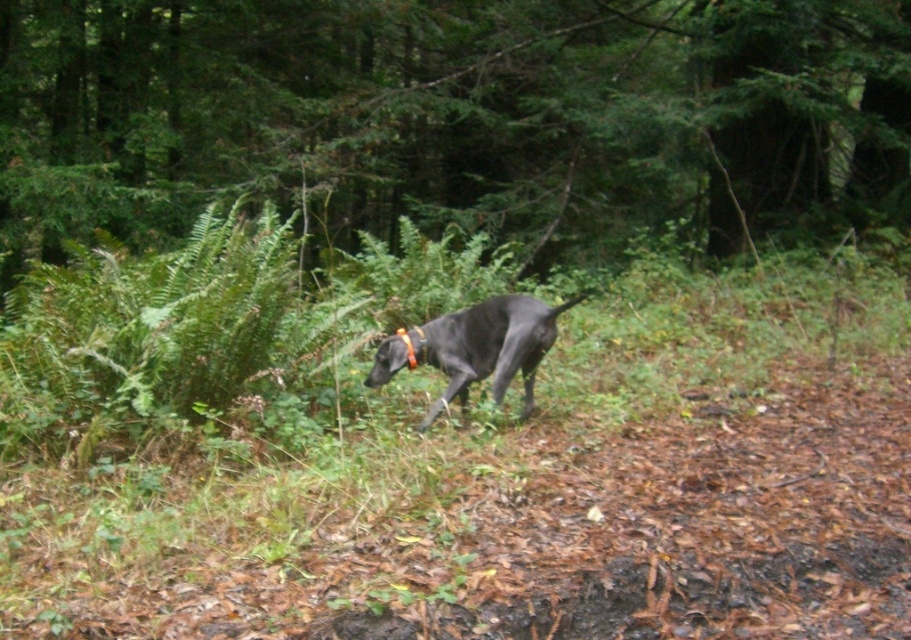
Can you confirm if green leafy tree at center is positioned above shiny black dog at center?

Yes.

Is green leafy tree at center bigger than shiny black dog at center?

Yes.

Who is more forward, (314, 193) or (518, 342)?

Point (518, 342) is more forward.

At what (x,y) coordinates should I click in order to perform the action: click on green leafy tree at center. Please return your answer as a coordinate pair (x, y). Looking at the image, I should click on (449, 115).